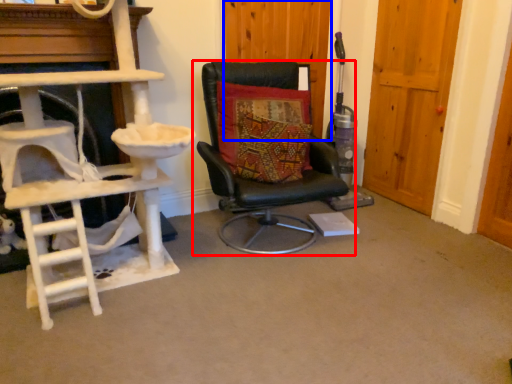
Question: Which object is further to the camera taking this photo, chair (highlighted by a red box) or door (highlighted by a blue box)?

Choices:
 (A) chair
 (B) door

Answer: (B)